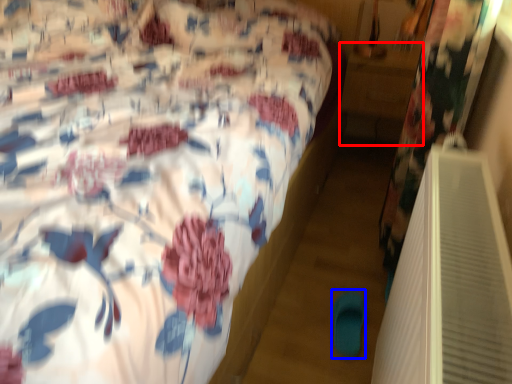
Question: Which point is further to the camera, table (highlighted by a red box) or slipper (highlighted by a blue box)?

Choices:
 (A) table
 (B) slipper

Answer: (A)